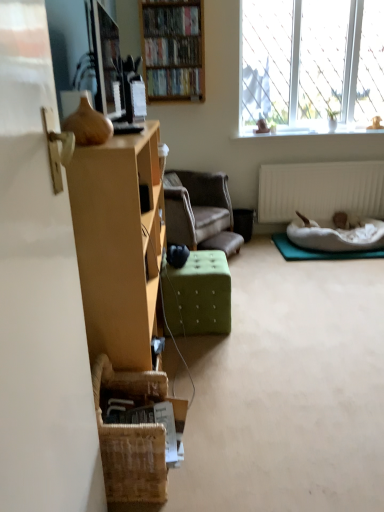
What do you see at coordinates (119, 243) in the screenshot? I see `light brown wood cabinet at left` at bounding box center [119, 243].

Where is `wooden bookshelf at upper center, the first book viewed from the top`? The image size is (384, 512). wooden bookshelf at upper center, the first book viewed from the top is located at coordinates (171, 20).

What is the approximate width of velvet brown armchair at center?

velvet brown armchair at center is 30.25 inches in width.

Measure the distance between white fluffy cat at lower right and camera.

The depth of white fluffy cat at lower right is 3.63 meters.

Identify the location of brown woven basket at lower left. (133, 434).

What is the approximate width of brown woven basket at lower left?

12.07 inches.

Identify the location of white textured radiator at lower right. (320, 190).

Does wooden bookshelf at upper center, which is counted as the third book, starting from the bottom, have a greater height compared to wooden bookshelf at upper center?

In fact, wooden bookshelf at upper center, which is counted as the third book, starting from the bottom, may be shorter than wooden bookshelf at upper center.

Can you see wooden bookshelf at upper center, which is counted as the third book, starting from the bottom, touching wooden bookshelf at upper center?

No, wooden bookshelf at upper center, which is counted as the third book, starting from the bottom, is not touching wooden bookshelf at upper center.

Where is `book that appears on the left of wooden bookshelf at upper center`? book that appears on the left of wooden bookshelf at upper center is located at coordinates (171, 20).

In the scene shown: Considering the sizes of wooden bookshelf at upper center, which is counted as the third book, starting from the bottom, and wooden bookshelf at upper center in the image, is wooden bookshelf at upper center, which is counted as the third book, starting from the bottom, wider or thinner than wooden bookshelf at upper center?

wooden bookshelf at upper center, which is counted as the third book, starting from the bottom, is wider than wooden bookshelf at upper center.

Is velvet brown armchair at center beside brown woven basket at lower left?

Answer: No, velvet brown armchair at center is not next to brown woven basket at lower left.

How different are the orientations of velvet brown armchair at center and brown woven basket at lower left in degrees?

The angular difference between velvet brown armchair at center and brown woven basket at lower left is 34.9 degrees.

From a real-world perspective, is velvet brown armchair at center on top of brown woven basket at lower left?

Yes, from a real-world perspective, velvet brown armchair at center is on top of brown woven basket at lower left.

Is brown woven basket at lower left at the back of velvet brown armchair at center?

That's not correct — velvet brown armchair at center is not looking away from brown woven basket at lower left.

From the image's perspective, which is below, shiny plastic bookshelf at upper center, the second book viewed from the top, or hardcover books at upper center, the first book ordered from the bottom?

hardcover books at upper center, the first book ordered from the bottom, is shown below in the image.

Can you see shiny plastic bookshelf at upper center, the second book viewed from the top, touching hardcover books at upper center, the first book ordered from the bottom?

No, shiny plastic bookshelf at upper center, the second book viewed from the top, is not with hardcover books at upper center, the first book ordered from the bottom.

Which object is thinner, shiny plastic bookshelf at upper center, the second book from the bottom, or hardcover books at upper center, marked as the third book in a top-to-bottom arrangement?

shiny plastic bookshelf at upper center, the second book from the bottom.

Which is closer, (280, 193) or (150, 74)?

Point (280, 193) is positioned farther from the camera compared to point (150, 74).

Looking at the image, does white textured radiator at lower right seem bigger or smaller compared to hardcover books at upper center, the first book ordered from the bottom?

Considering their sizes, white textured radiator at lower right takes up more space than hardcover books at upper center, the first book ordered from the bottom.

Which book is the 1st one when counting from the front of the white textured radiator at lower right? Please provide its 2D coordinates.

[(174, 82)]

Between white fluffy cat at lower right and wooden bookshelf at upper center, which is counted as the third book, starting from the bottom, which one has smaller width?

With smaller width is wooden bookshelf at upper center, which is counted as the third book, starting from the bottom.

Is white fluffy cat at lower right facing towards wooden bookshelf at upper center, the first book viewed from the top?

No.

Which of these two, white fluffy cat at lower right or wooden bookshelf at upper center, which is counted as the third book, starting from the bottom, is smaller?

white fluffy cat at lower right is smaller.

Which is in front, white fluffy cat at lower right or white soft pet bed at lower right?

white soft pet bed at lower right is closer to the camera.

Is white fluffy cat at lower right touching white soft pet bed at lower right?

No, white fluffy cat at lower right is not next to white soft pet bed at lower right.

You are a GUI agent. You are given a task and a screenshot of the screen. Output one action in this format:
    pyautogui.click(x=<x>, y=<y>)
    Task: Click on the animal located above the white soft pet bed at lower right (from the image's perspective)
    The image size is (384, 512).
    Given the screenshot: What is the action you would take?
    pyautogui.click(x=346, y=220)

The width and height of the screenshot is (384, 512). Find the location of `cabinetry in front of the clear glass window at upper right`. cabinetry in front of the clear glass window at upper right is located at coordinates (119, 243).

What's the angular difference between clear glass window at upper right and light brown wood cabinet at left's facing directions?

92.6 degrees separate the facing orientations of clear glass window at upper right and light brown wood cabinet at left.

From a real-world perspective, is clear glass window at upper right physically above light brown wood cabinet at left?

Yes, from a real-world perspective, clear glass window at upper right is over light brown wood cabinet at left

Does clear glass window at upper right lie behind light brown wood cabinet at left?

Yes, clear glass window at upper right is behind light brown wood cabinet at left.

Find the location of `book that appears above the wooden bookshelf at upper center (from a real-world perspective)`. book that appears above the wooden bookshelf at upper center (from a real-world perspective) is located at coordinates (171, 20).

Locate an element on the screen. basket in front of the velvet brown armchair at center is located at coordinates (133, 434).

From the image, which object appears to be nearer to white fluffy cat at lower right, white textured radiator at lower right or brown woven basket at lower left?

white textured radiator at lower right.

In the scene shown: Based on their spatial positions, is velvet brown armchair at center or white fluffy cat at lower right closer to green fabric ottoman at center?

A: The object closer to green fabric ottoman at center is velvet brown armchair at center.

Considering their positions, is wooden bookshelf at upper center, which is counted as the third book, starting from the bottom, positioned closer to shiny plastic bookshelf at upper center, the second book from the bottom, than white soft pet bed at lower right?

Among the two, wooden bookshelf at upper center, which is counted as the third book, starting from the bottom, is located nearer to shiny plastic bookshelf at upper center, the second book from the bottom.

Looking at the image, which one is located further to white fluffy cat at lower right, white soft pet bed at lower right or shiny plastic bookshelf at upper center, the second book viewed from the top?

shiny plastic bookshelf at upper center, the second book viewed from the top.

When comparing their distances from brown woven basket at lower left, does clear glass window at upper right or white textured radiator at lower right seem closer?

white textured radiator at lower right lies closer to brown woven basket at lower left than the other object.

Looking at the image, which one is located closer to brown woven basket at lower left, white soft pet bed at lower right or light brown wood cabinet at left?

light brown wood cabinet at left is positioned closer to the anchor brown woven basket at lower left.

Looking at the image, which one is located further to velvet brown armchair at center, wooden bookshelf at upper center, which is counted as the third book, starting from the bottom, or white textured radiator at lower right?

wooden bookshelf at upper center, which is counted as the third book, starting from the bottom, lies further to velvet brown armchair at center than the other object.

Considering their positions, is velvet brown armchair at center positioned closer to brown woven basket at lower left than clear glass window at upper right?

Based on the image, velvet brown armchair at center appears to be nearer to brown woven basket at lower left.

The image size is (384, 512). What are the coordinates of `bookcase between wooden bookshelf at upper center, which is counted as the third book, starting from the bottom, and velvet brown armchair at center from top to bottom` in the screenshot? It's located at (173, 49).

Locate an element on the screen. This screenshot has width=384, height=512. animal between white soft pet bed at lower right and white textured radiator at lower right from front to back is located at coordinates (346, 220).

What are the coordinates of `bed between wooden bookshelf at upper center and green fabric ottoman at center vertically` in the screenshot? It's located at (331, 240).

Find the location of a particular element. This screenshot has width=384, height=512. book between light brown wood cabinet at left and shiny plastic bookshelf at upper center, the second book viewed from the top, in the front-back direction is located at coordinates (171, 20).